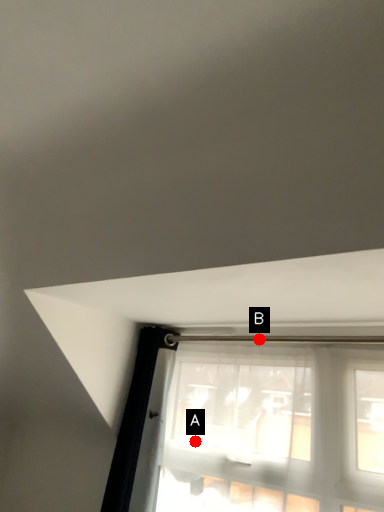
Question: Two points are circled on the image, labeled by A and B beside each circle. Which of the following is the farthest from the observer?

Choices:
 (A) A is further
 (B) B is further

Answer: (B)